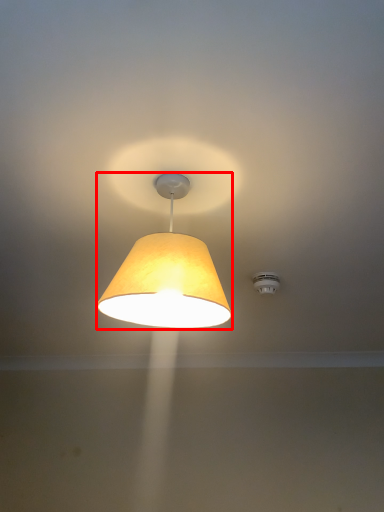
Question: Observing the image, what is the correct spatial positioning of lamp (annotated by the red box) in reference to lighting?

Choices:
 (A) right
 (B) left

Answer: (B)